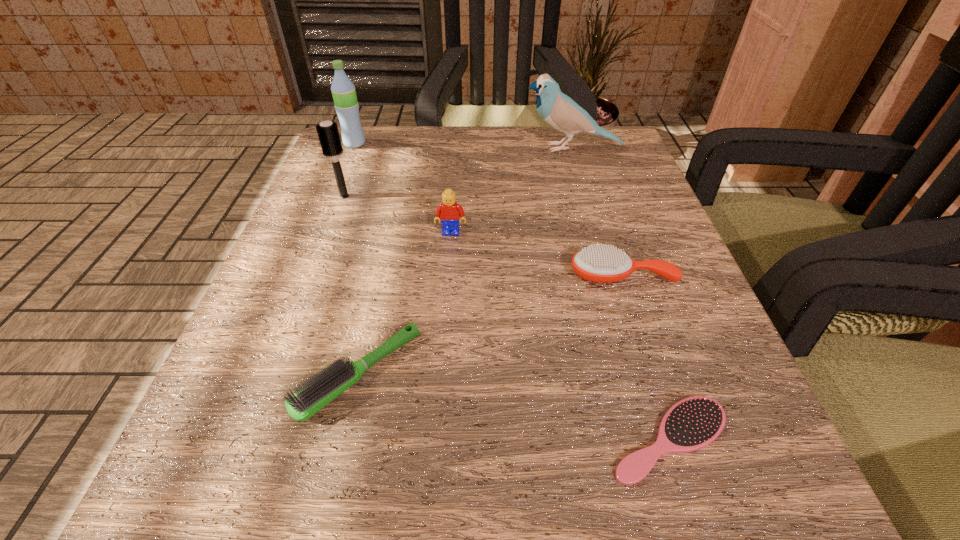
This screenshot has width=960, height=540. In order to click on free space at the left edge in this screenshot , I will do `click(360, 336)`.

The height and width of the screenshot is (540, 960). In the image, there is a desktop. In order to click on vacant space at the right edge in this screenshot , I will do `click(691, 305)`.

Identify the location of free region at the far left corner of the desktop. (396, 128).

At what (x,y) coordinates should I click in order to perform the action: click on free region at the near left corner of the desktop. Please return your answer as a coordinate pair (x, y). Looking at the image, I should click on (185, 529).

Where is `vacant area at the far right corner of the desktop`? Image resolution: width=960 pixels, height=540 pixels. vacant area at the far right corner of the desktop is located at coordinates (603, 158).

This screenshot has height=540, width=960. In order to click on vacant area that lies between the second shortest hairbrush and the leftmost hairbrush in this screenshot , I will do `click(351, 285)`.

The width and height of the screenshot is (960, 540). Find the location of `free area in between the third shortest hairbrush and the fourth tallest object`. free area in between the third shortest hairbrush and the fourth tallest object is located at coordinates (536, 254).

You are a GUI agent. You are given a task and a screenshot of the screen. Output one action in this format:
    pyautogui.click(x=<x>, y=<y>)
    Task: Click on the free point between the bird and the fifth tallest object
    The height and width of the screenshot is (540, 960).
    Given the screenshot: What is the action you would take?
    pyautogui.click(x=596, y=212)

This screenshot has height=540, width=960. I want to click on vacant area that lies between the third object from left to right and the third farthest object, so click(x=351, y=285).

Locate an element on the screen. vacant area between the third shortest object and the bird is located at coordinates (596, 212).